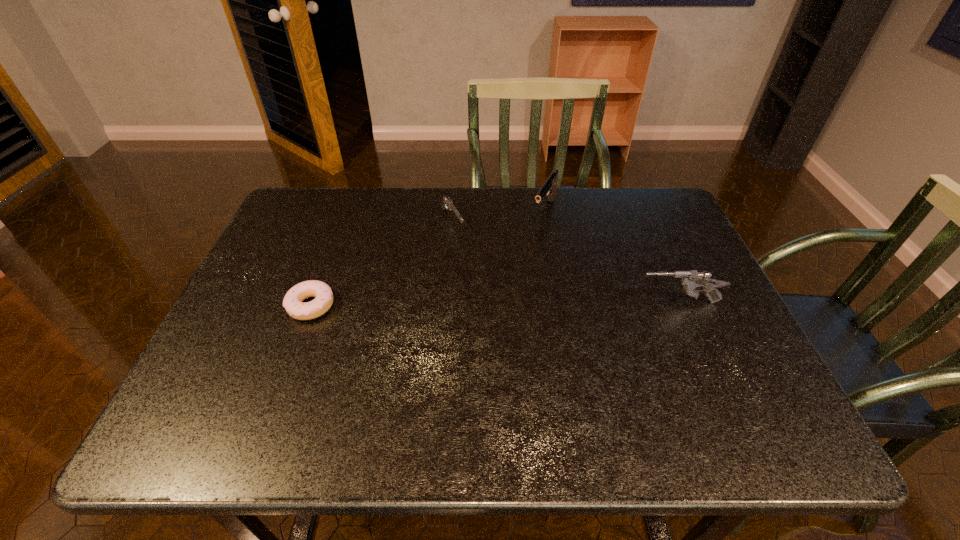
The height and width of the screenshot is (540, 960). I want to click on vacant space that's between the second shortest object and the rightmost object, so click(x=565, y=262).

This screenshot has width=960, height=540. I want to click on free spot between the second object from right to left and the shortest object, so click(428, 258).

Find the location of `free area in between the third object from right to left and the rightmost object`. free area in between the third object from right to left and the rightmost object is located at coordinates (565, 262).

I want to click on vacant area between the rightmost object and the left pistol, so click(565, 262).

I want to click on the third closest object to the shorter pistol, so click(x=692, y=279).

Identify which object is the third closest to the gun. Please provide its 2D coordinates. Your answer should be formatted as a tuple, i.e. [(x, y)], where the tuple contains the x and y coordinates of a point satisfying the conditions above.

[(292, 302)]

You are a GUI agent. You are given a task and a screenshot of the screen. Output one action in this format:
    pyautogui.click(x=<x>, y=<y>)
    Task: Click on the vacant point that satisfies the following two spatial constraints: 1. on the back side of the second object from right to left; 2. on the right side of the second object from left to right
    This screenshot has width=960, height=540.
    Given the screenshot: What is the action you would take?
    pyautogui.click(x=453, y=210)

Locate an element on the screen. This screenshot has width=960, height=540. vacant space that satisfies the following two spatial constraints: 1. on the back side of the gun; 2. at the barrel of the shortest object is located at coordinates (313, 302).

Where is `free space that satisfies the following two spatial constraints: 1. on the front side of the third object from right to left; 2. at the barrel of the gun`? The image size is (960, 540). free space that satisfies the following two spatial constraints: 1. on the front side of the third object from right to left; 2. at the barrel of the gun is located at coordinates (446, 302).

You are a GUI agent. You are given a task and a screenshot of the screen. Output one action in this format:
    pyautogui.click(x=<x>, y=<y>)
    Task: Click on the blank space that satisfies the following two spatial constraints: 1. on the back side of the taller pistol; 2. on the right side of the shortest object
    The width and height of the screenshot is (960, 540).
    Given the screenshot: What is the action you would take?
    pyautogui.click(x=347, y=210)